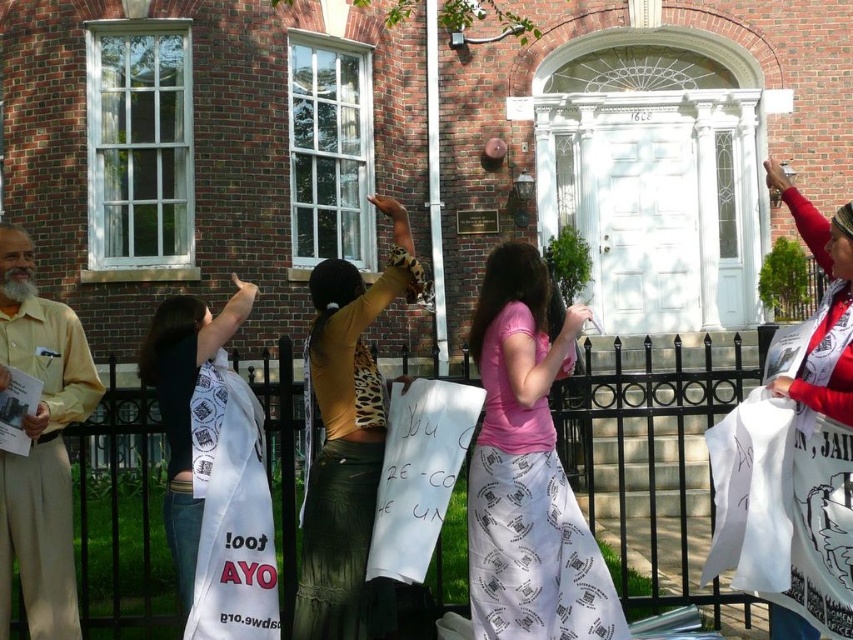
You are standing in front of the brick building with the white door. You notice a point marked at coordinates [527,472]. What object is located at that point?

The point at coordinates [527,472] corresponds to the pink fabric skirt at center.

You are standing in front of the brick building and notice the pink fabric skirt at center. Can you determine its exact location using the coordinate system provided?

The pink fabric skirt at center is located at point (527,472) according to the coordinate system provided.

Consider the image. You are a protester standing at the left side of the scene. You want to move closer to the brick building. Which object is directly in your path between the beige cotton pants at left and the black metal fence at center?

The beige cotton pants at left are on the left side, and the black metal fence at center is to their right. Since you are standing at the left side near the beige cotton pants at left, the black metal fence at center would be directly in your path as you move toward the brick building.